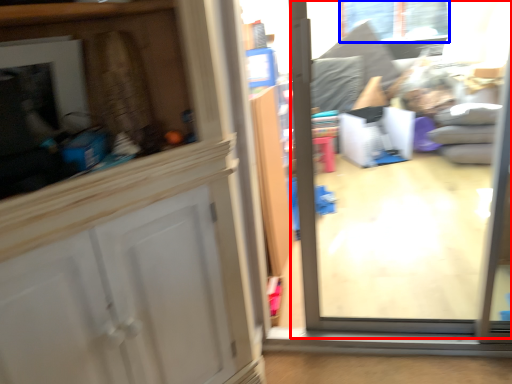
Question: Which of the following is the closest to the observer, glass door (highlighted by a red box) or window (highlighted by a blue box)?

Choices:
 (A) glass door
 (B) window

Answer: (A)